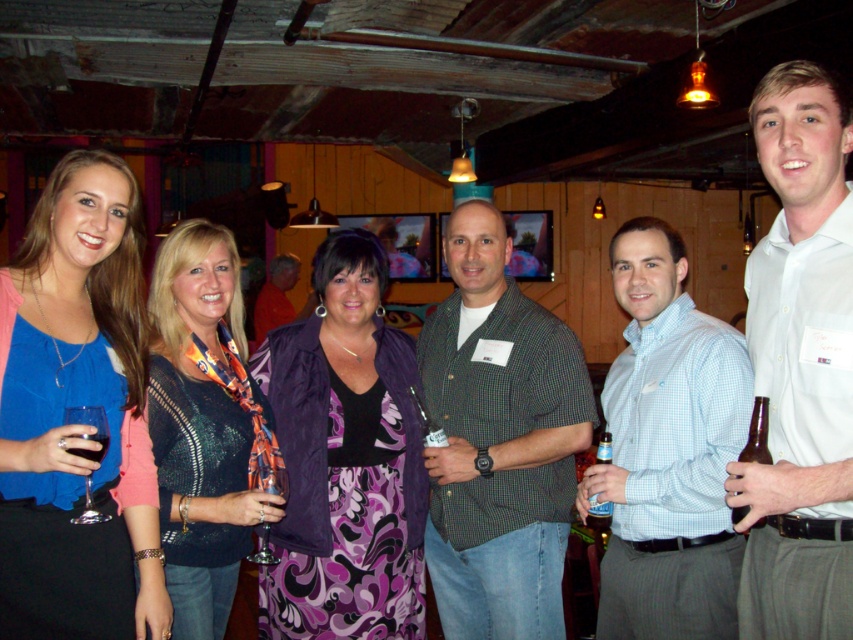
Question: Considering the relative positions of purple fabric dress at center and clear glass wine glass at center in the image provided, where is purple fabric dress at center located with respect to clear glass wine glass at center?

Choices:
 (A) below
 (B) above

Answer: (B)

Question: Which object is closer to the camera taking this photo?

Choices:
 (A) purple fabric dress at center
 (B) brown glass bottle at right

Answer: (B)

Question: Estimate the real-world distances between objects in this image. Which object is closer to the clear glass wine glass at center?

Choices:
 (A) purple fabric dress at center
 (B) clear glass bottle at center
 (C) transparent glass at lower left

Answer: (A)

Question: Does matte blue blouse at center appear over clear glass wine glass at center?

Choices:
 (A) yes
 (B) no

Answer: (A)

Question: Which point appears farthest from the camera in this image?

Choices:
 (A) (421, 358)
 (B) (99, 426)

Answer: (A)

Question: Considering the relative positions of knitted sweater at center and brown glass bottle at right in the image provided, where is knitted sweater at center located with respect to brown glass bottle at right?

Choices:
 (A) below
 (B) above

Answer: (B)